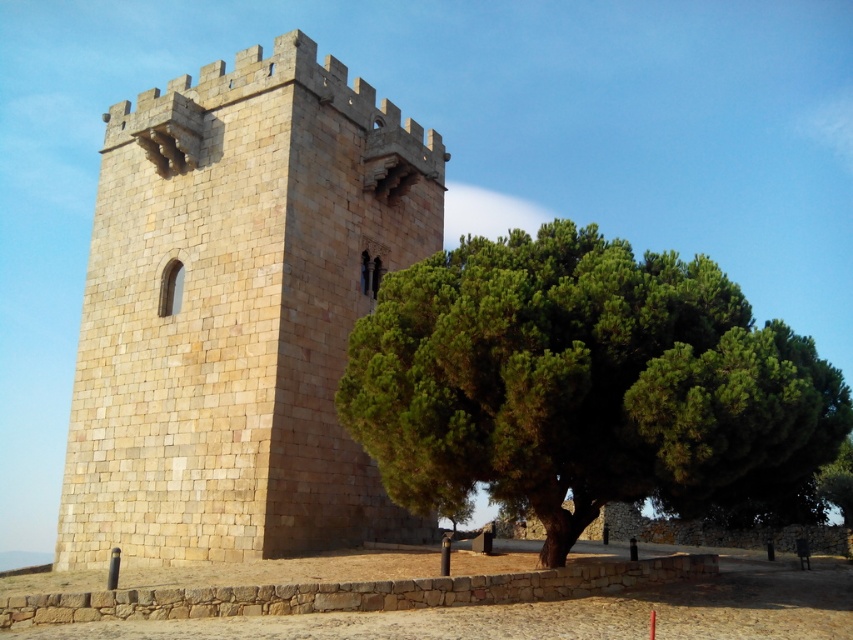
Does beige stone tower at center appear on the left side of green leafy tree at center?

Yes, beige stone tower at center is to the left of green leafy tree at center.

Which of these two, beige stone tower at center or green leafy tree at center, stands shorter?

With less height is green leafy tree at center.

At what (x,y) coordinates should I click in order to perform the action: click on beige stone tower at center. Please return your answer as a coordinate pair (x, y). Looking at the image, I should click on (238, 312).